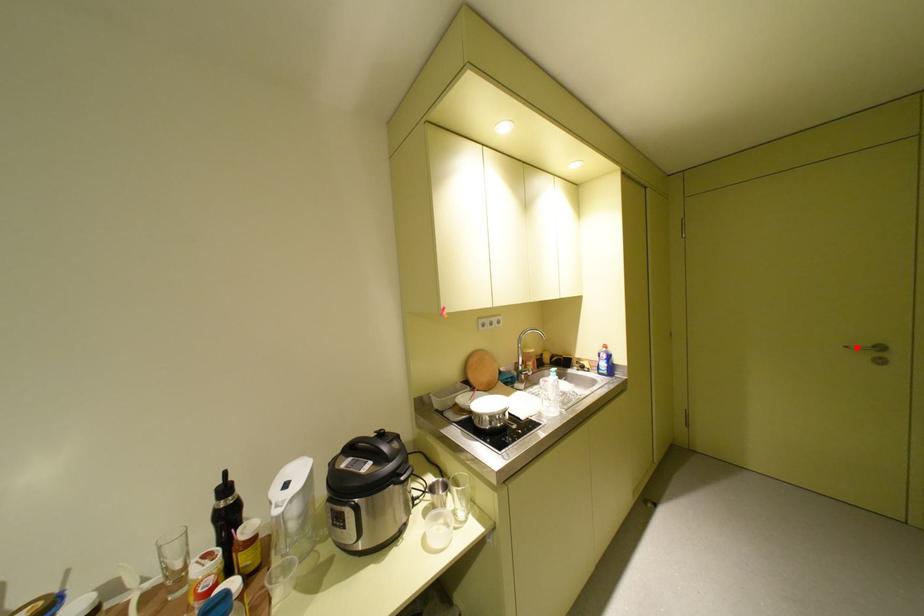
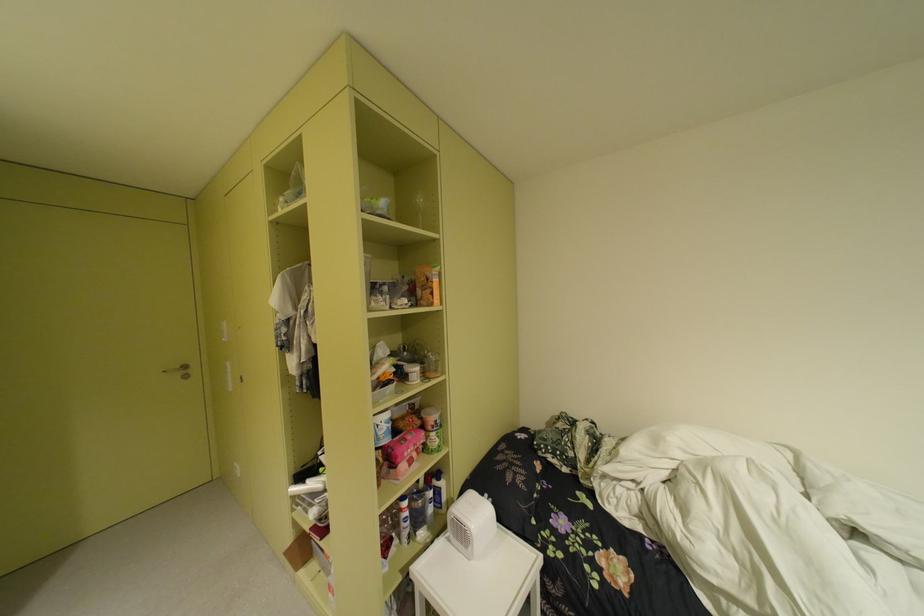
Where in the second image is the point corresponding to the highlighted location from the first image?

(175, 371)